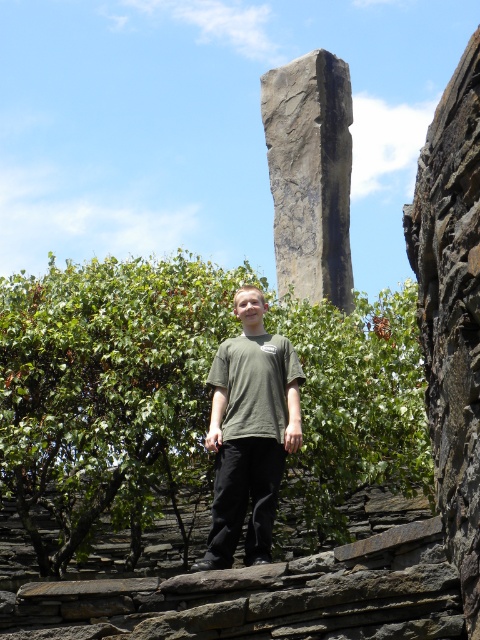
Question: Observing the image, what is the correct spatial positioning of rusty stone wall at right in reference to green matte shirt at center?

Choices:
 (A) above
 (B) below

Answer: (A)

Question: Can you confirm if gray rough stone at center is positioned above green matte shirt at center?

Choices:
 (A) yes
 (B) no

Answer: (A)

Question: Estimate the real-world distances between objects in this image. Which object is farther from the green matte shirt at center?

Choices:
 (A) rusty stone wall at right
 (B) gray rough stone at center

Answer: (B)

Question: Estimate the real-world distances between objects in this image. Which object is farther from the green matte shirt at center?

Choices:
 (A) rusty stone wall at right
 (B) gray rough stone at center

Answer: (B)

Question: Is rusty stone wall at right below gray rough stone at center?

Choices:
 (A) yes
 (B) no

Answer: (A)

Question: Estimate the real-world distances between objects in this image. Which object is closer to the green matte shirt at center?

Choices:
 (A) gray rough stone at center
 (B) rusty stone wall at right

Answer: (B)